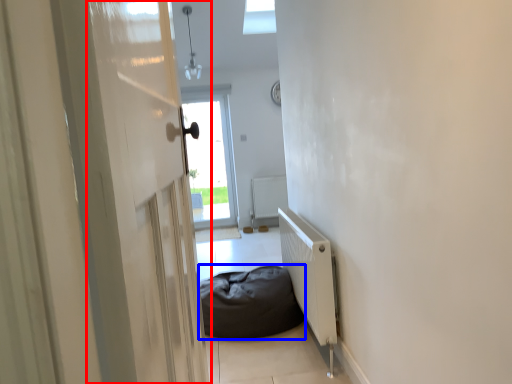
Question: Among these objects, which one is nearest to the camera, screen door (highlighted by a red box) or furniture (highlighted by a blue box)?

Choices:
 (A) screen door
 (B) furniture

Answer: (A)